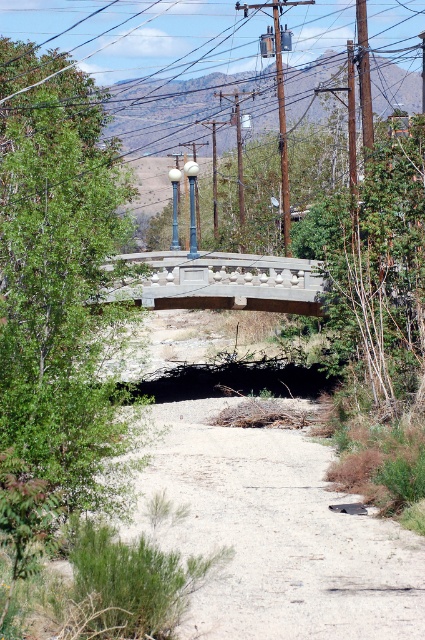
You are a photographer standing at the edge of a dry riverbed. You want to take a photo of the gray concrete bridge at center. If your camera has a maximum focus range of 10 meters, will you be able to capture the bridge clearly?

The gray concrete bridge at center is 10.51 meters away from the camera. Since the maximum focus range is 10 meters, the bridge is slightly out of range and may not be captured clearly.

You are a pedestrian walking along the dry riverbed and want to cross to the other side. There is a gray concrete bridge at center and a polished metal lamp post at center. Which object should you approach first to safely cross the riverbed?

You should approach the gray concrete bridge at center first because it is positioned under the polished metal lamp post at center, meaning the bridge is closer to you and directly spans the riverbed, allowing safe passage.

You are standing at the curved concrete bridge in the foreground of the dry riverbed scene. You notice two points marked in the image. Which point, point (299, 268) or point (197, 250), is closer to you?

Point (299, 268) is closer to the viewer than point (197, 250).